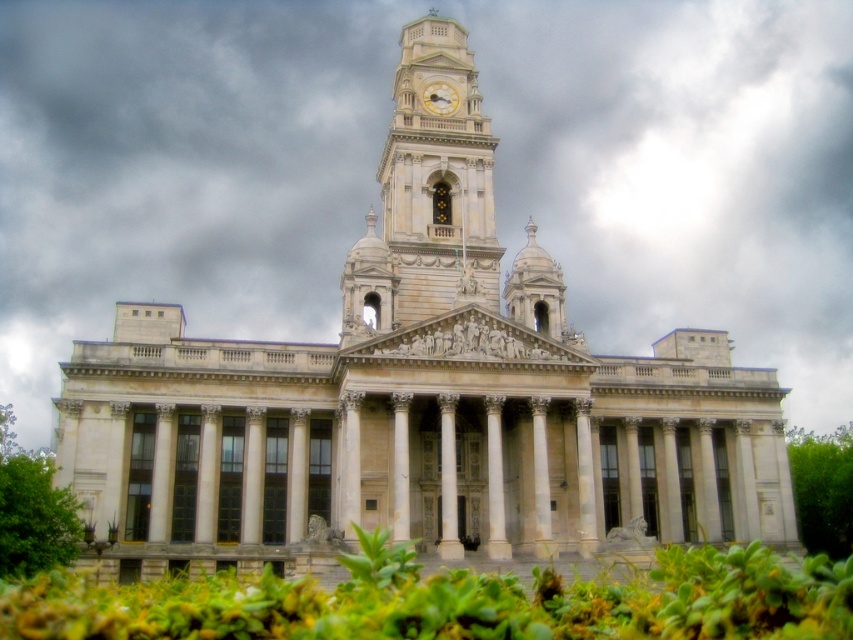
Question: Which object is the closest to the green leafy bush at lower left?

Choices:
 (A) green leafy bush at lower center
 (B) green leafy bush at lower right

Answer: (A)

Question: Can you confirm if green leafy bush at lower center is bigger than green leafy bush at lower right?

Choices:
 (A) no
 (B) yes

Answer: (A)

Question: Where is green leafy bush at lower left located in relation to green leafy bush at lower right in the image?

Choices:
 (A) left
 (B) right

Answer: (A)

Question: Estimate the real-world distances between objects in this image. Which object is closer to the gold metallic clock at upper center?

Choices:
 (A) green leafy bush at lower right
 (B) white fluffy cloud at upper center
 (C) green leafy bush at lower left

Answer: (C)

Question: Is white fluffy cloud at upper center to the left of gold metallic clock at upper center from the viewer's perspective?

Choices:
 (A) yes
 (B) no

Answer: (A)

Question: Which point is closer to the camera taking this photo?

Choices:
 (A) (433, 102)
 (B) (236, 611)
 (C) (633, 333)
 (D) (33, 525)

Answer: (B)